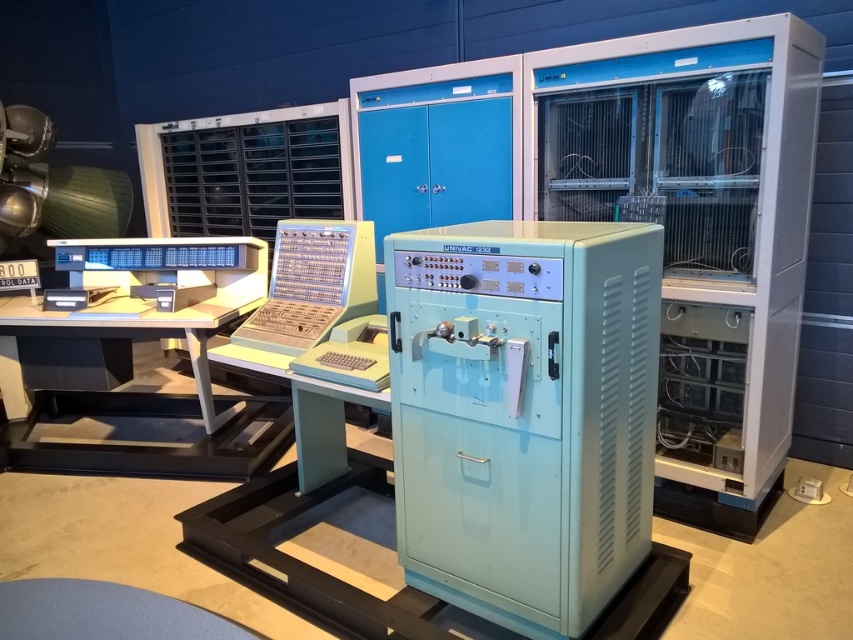
Question: Is light blue plastic univac 1502 at center to the left of yellow plastic keyboard at center from the viewer's perspective?

Choices:
 (A) yes
 (B) no

Answer: (B)

Question: Among these objects, which one is nearest to the camera?

Choices:
 (A) light blue plastic univac 1502 at center
 (B) yellow plastic keyboard at center

Answer: (A)

Question: Which point appears farthest from the camera in this image?

Choices:
 (A) (238, 339)
 (B) (585, 364)

Answer: (A)

Question: Can you confirm if light blue plastic univac 1502 at center is thinner than yellow plastic keyboard at center?

Choices:
 (A) yes
 (B) no

Answer: (B)

Question: Does light blue plastic univac 1502 at center appear over yellow plastic keyboard at center?

Choices:
 (A) no
 (B) yes

Answer: (A)

Question: Which object is closer to the camera taking this photo?

Choices:
 (A) light blue plastic univac 1502 at center
 (B) yellow plastic keyboard at center

Answer: (A)